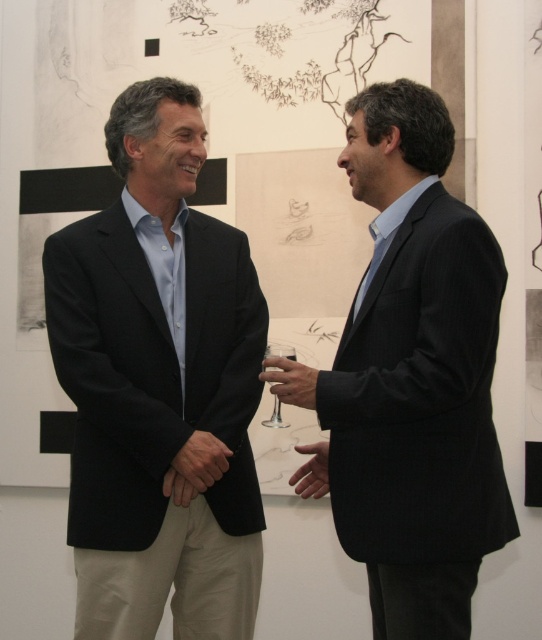
Is point (289, 374) positioned after point (302, 488)?

No.

You are a GUI agent. You are given a task and a screenshot of the screen. Output one action in this format:
    pyautogui.click(x=<x>, y=<y>)
    Task: Click on the matte glass wine glass at center
    
    Given the screenshot: What is the action you would take?
    (291, 381)

Between smooth beige hand at center and clear glass wine glass at center, which one has more height?

Standing taller between the two is clear glass wine glass at center.

Does smooth beige hand at center appear on the left side of clear glass wine glass at center?

Yes, smooth beige hand at center is to the left of clear glass wine glass at center.

Is point (199, 440) positioned before point (275, 410)?

Yes.

At what (x,y) coordinates should I click in order to perform the action: click on smooth beige hand at center. Please return your answer as a coordinate pair (x, y). Image resolution: width=542 pixels, height=640 pixels. Looking at the image, I should click on (196, 467).

Who is positioned more to the left, smooth beige hand at center or smooth skin hand at center?

smooth beige hand at center is more to the left.

Where is `smooth beige hand at center`? The width and height of the screenshot is (542, 640). smooth beige hand at center is located at coordinates (196, 467).

Is point (203, 445) positioned before point (314, 458)?

Yes, it is in front of point (314, 458).

Find the location of a particular element. smooth beige hand at center is located at coordinates (196, 467).